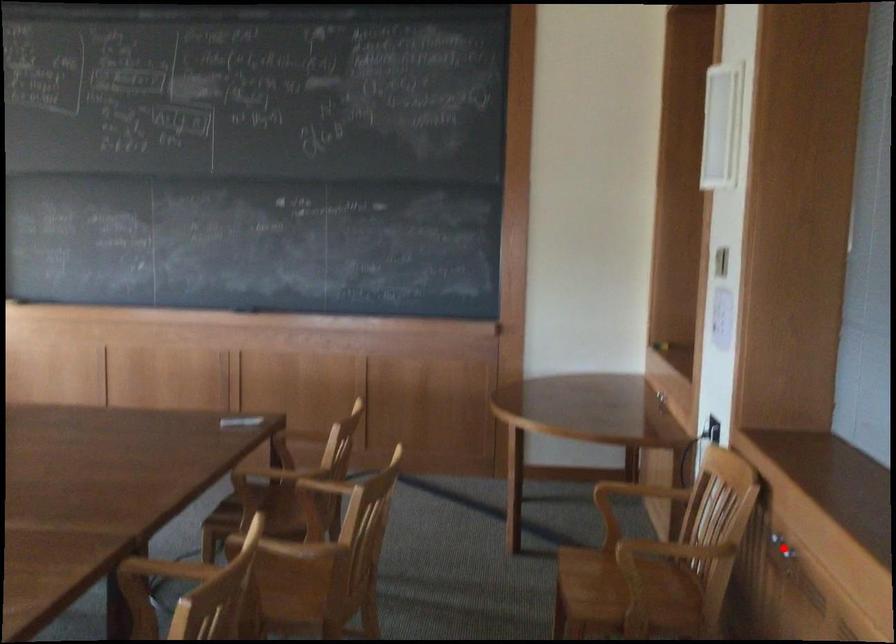
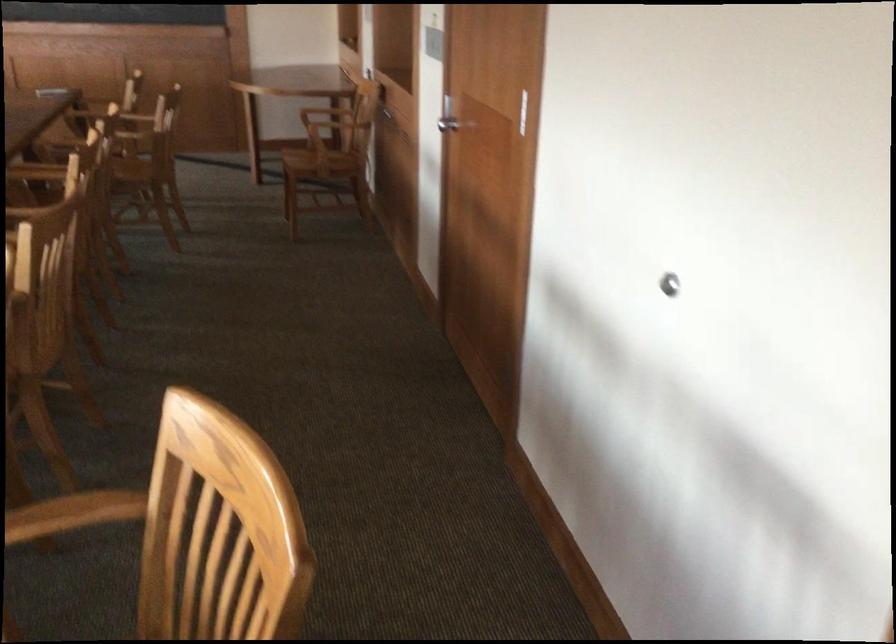
Question: I am providing you with two images of the same scene from different viewpoints. A red point is marked on the first image. Is the red point's position out of view in image 2?

Choices:
 (A) Yes
 (B) No

Answer: (A)